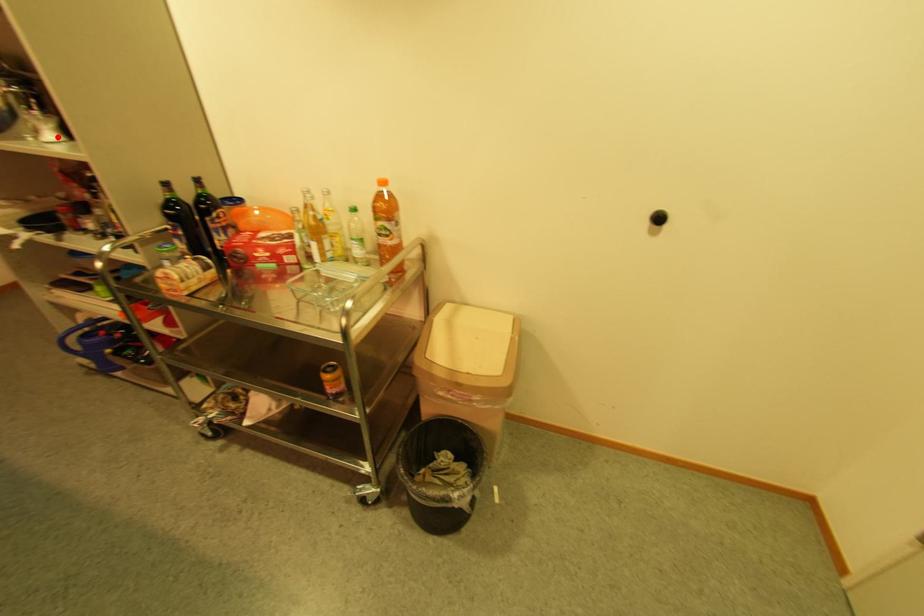
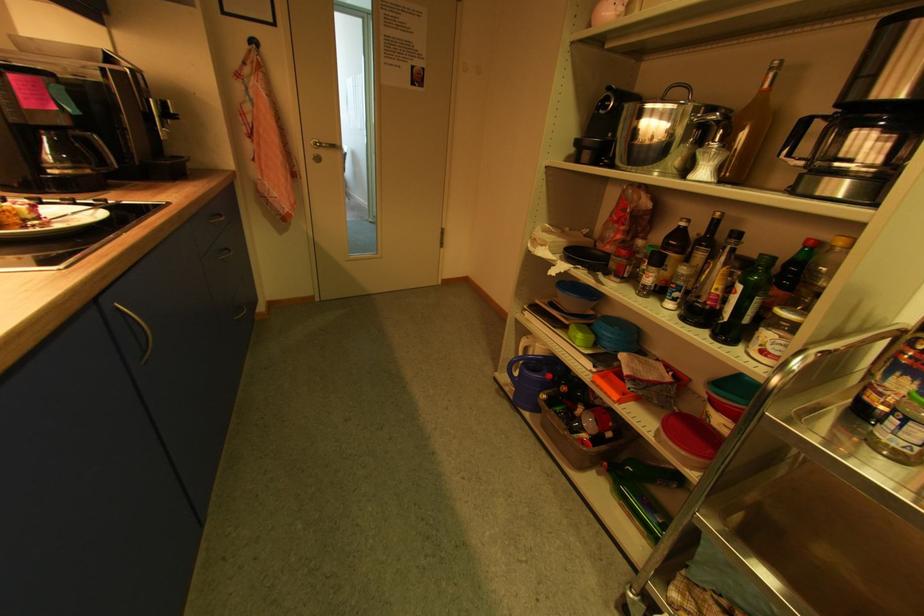
Locate, in the second image, the point that corresponds to the highlighted location in the first image.

(709, 175)